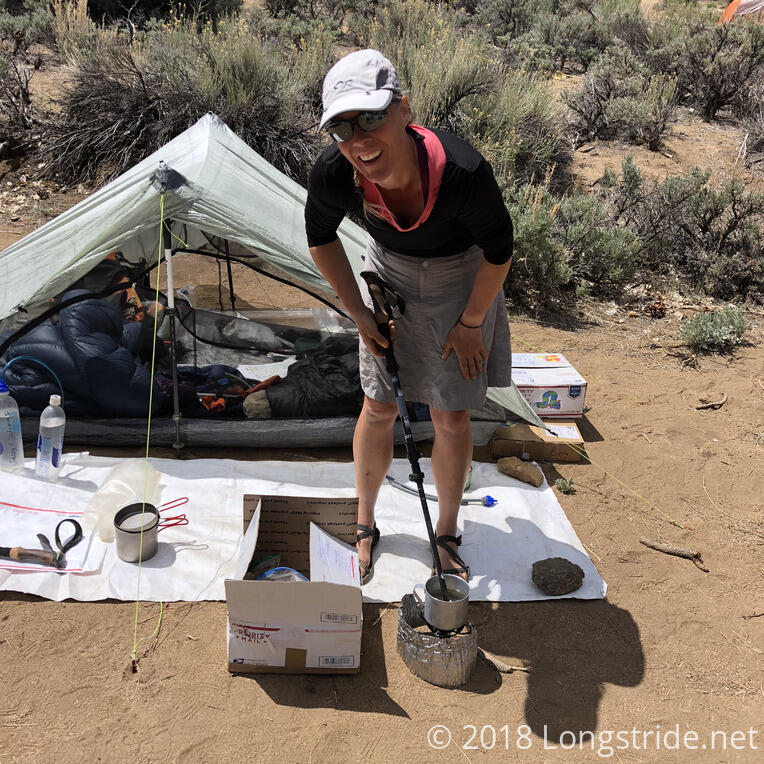
Locate an element on the screen. The image size is (764, 764). handle is located at coordinates (173, 502), (173, 520), (387, 348).